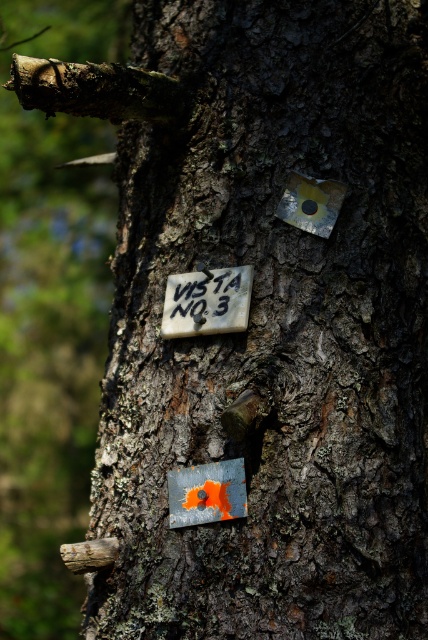
You are an arborist inspecting the tree trunk. You notice two items at the center of the trunk. Which one is closer to you, the white paper at center or the orange painted metal sign at center?

The white paper at center is closer to you because the orange painted metal sign at center is behind it.

You are a park ranger trying to locate a specific marker on a tree trunk. You have a map with coordinates. According to the map, where should you look to find the white paper at center?

The white paper at center is located at the coordinates point (207, 301).

Consider the image. You are a hiker trying to read the markers on the tree trunk. Which object is covering the other one, the white paper at center or the orange painted metal sign at center?

The white paper at center is positioned over orange painted metal sign at center, so the white paper at center is covering the orange painted metal sign at center.